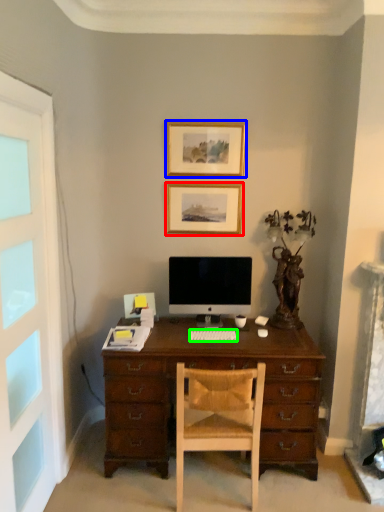
Question: Which object is the closest to the picture frame (highlighted by a red box)? Choose among these: picture frame (highlighted by a blue box) or computer keyboard (highlighted by a green box).

Choices:
 (A) picture frame
 (B) computer keyboard

Answer: (A)